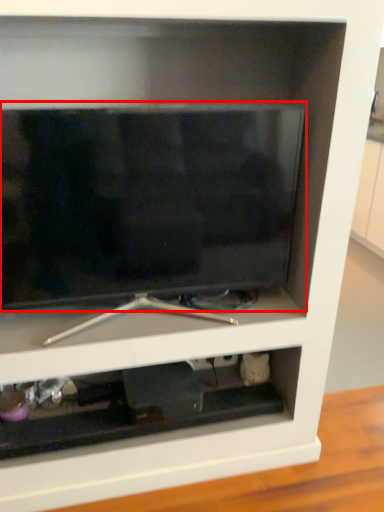
Question: From the image's perspective, what is the correct spatial relationship of television (annotated by the red box) in relation to cabinet?

Choices:
 (A) above
 (B) below

Answer: (A)